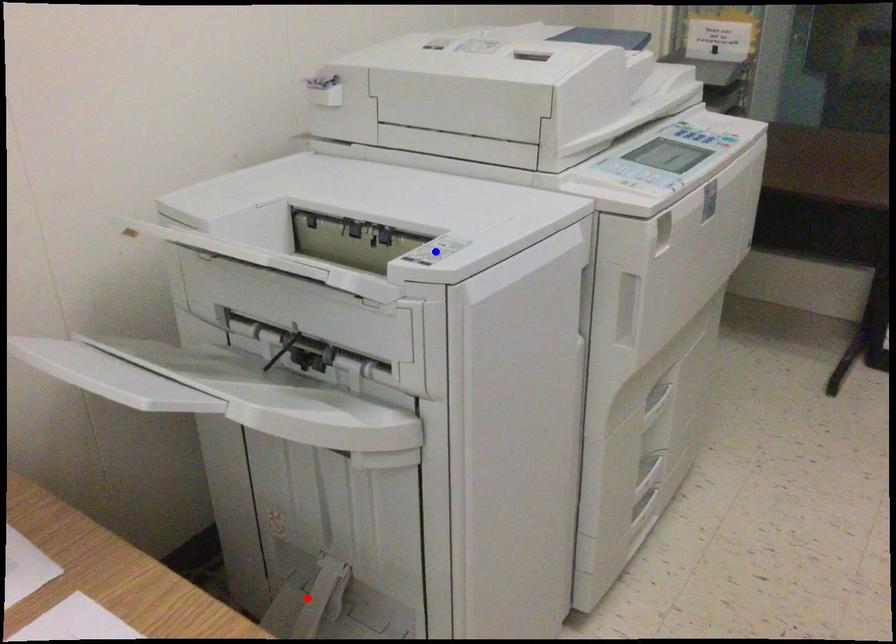
Question: Which of the two points in the image is closer to the camera?

Choices:
 (A) Blue point is closer.
 (B) Red point is closer.

Answer: (A)